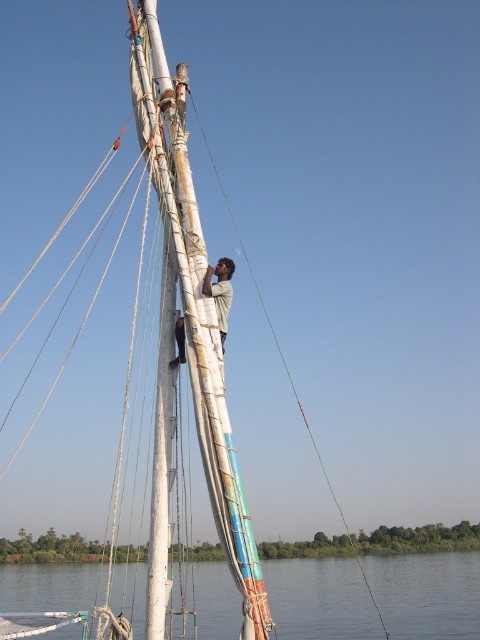
Question: Which point is closer to the camera?

Choices:
 (A) (46, 595)
 (B) (225, 316)

Answer: (B)

Question: Which point is closer to the camera taking this photo?

Choices:
 (A) (342, 627)
 (B) (181, 330)

Answer: (B)

Question: Is transparent water at lower center bigger than light brown fabric shirt at center?

Choices:
 (A) yes
 (B) no

Answer: (A)

Question: Does transparent water at lower center have a larger size compared to light brown fabric shirt at center?

Choices:
 (A) no
 (B) yes

Answer: (B)

Question: Does transparent water at lower center come behind light brown fabric shirt at center?

Choices:
 (A) yes
 (B) no

Answer: (A)

Question: Which of the following is the farthest from the observer?

Choices:
 (A) light brown fabric shirt at center
 (B) transparent water at lower center

Answer: (B)